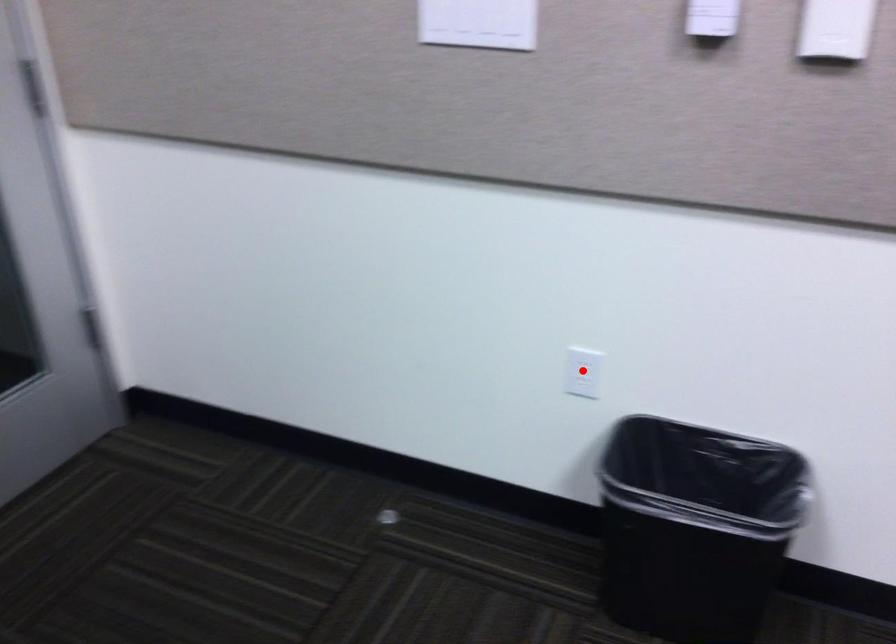
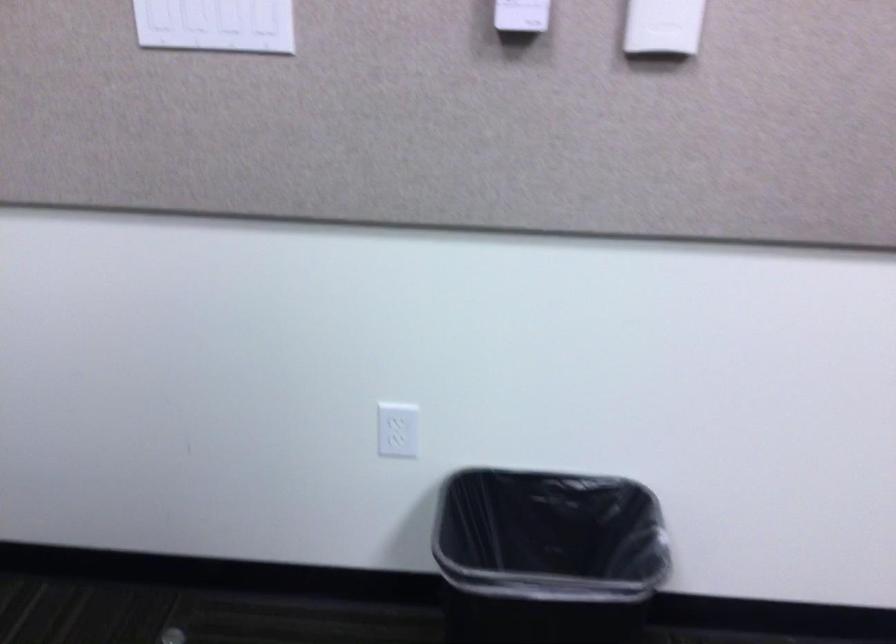
Question: I am providing you with two images of the same scene from different viewpoints. Given a red point in image1, look at the same physical point in image2. Is it:

Choices:
 (A) Closer to the viewpoint
 (B) Farther from the viewpoint

Answer: (A)